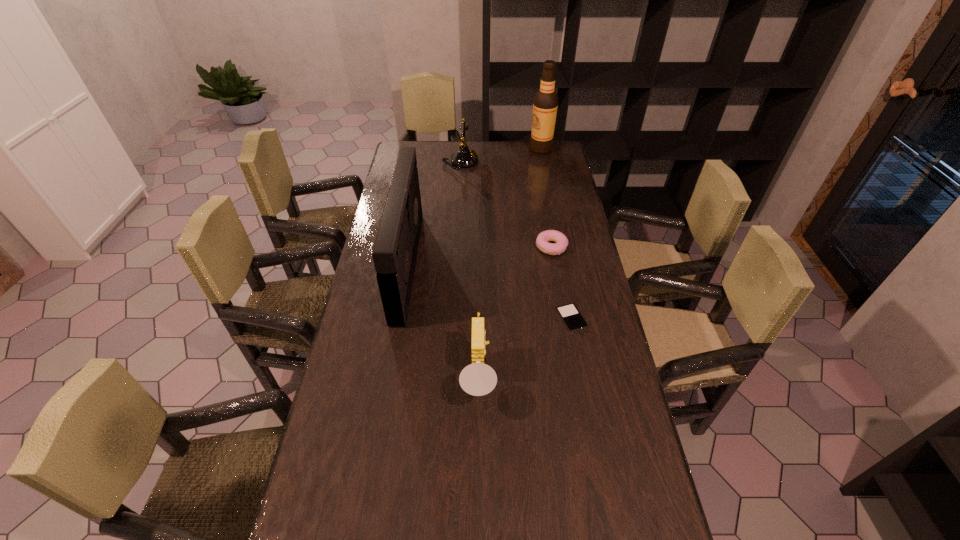
At what (x,y) coordinates should I click in order to perform the action: click on iPod located at the right edge. Please return your answer as a coordinate pair (x, y). This screenshot has width=960, height=540. Looking at the image, I should click on (573, 320).

Find the location of `object present at the far right corner`. object present at the far right corner is located at coordinates point(545,103).

Image resolution: width=960 pixels, height=540 pixels. In the image, there is a desktop. Identify the location of vacant space at the left edge. 342,447.

Locate an element on the screen. free space at the right edge is located at coordinates (599, 485).

In the image, there is a desktop. Identify the location of free space at the far right corner. This screenshot has height=540, width=960. (534, 163).

The height and width of the screenshot is (540, 960). I want to click on vacant region between the telephone and the leftmost object, so click(434, 214).

You are a GUI agent. You are given a task and a screenshot of the screen. Output one action in this format:
    pyautogui.click(x=<x>, y=<y>)
    Task: Click on the empty space between the doughnut and the nearest object
    The width and height of the screenshot is (960, 540).
    Given the screenshot: What is the action you would take?
    pyautogui.click(x=515, y=312)

The image size is (960, 540). What are the coordinates of `free spot between the doughnut and the fifth shortest object` in the screenshot? It's located at pos(479,256).

You are a GUI agent. You are given a task and a screenshot of the screen. Output one action in this format:
    pyautogui.click(x=<x>, y=<y>)
    Task: Click on the vacant area that lies between the videotape and the tallest object
    
    Given the screenshot: What is the action you would take?
    pyautogui.click(x=474, y=207)

I want to click on empty space between the alcohol and the fifth tallest object, so click(546, 198).